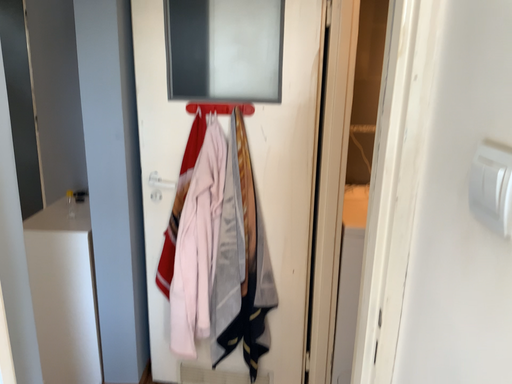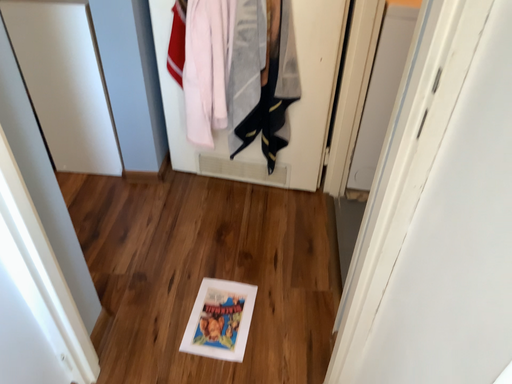
Question: Which way did the camera rotate in the video?

Choices:
 (A) rotated upward
 (B) rotated downward

Answer: (B)